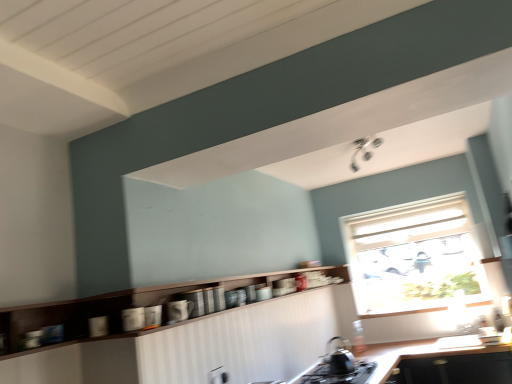
Question: Considering the positions of matte ceramic mug at center, marked as the second appliance in a front-to-back arrangement, and black matte tea pot at lower center in the image, is matte ceramic mug at center, marked as the second appliance in a front-to-back arrangement, wider or thinner than black matte tea pot at lower center?

Choices:
 (A) wide
 (B) thin

Answer: (B)

Question: Does point (183, 294) appear closer or farther from the camera than point (343, 337)?

Choices:
 (A) closer
 (B) farther

Answer: (A)

Question: Which object is positioned closest to the black matte countertop at lower center?

Choices:
 (A) black matte gas stove at lower center
 (B) white textured window at upper right
 (C) glossy ceramic mug at lower center, the 2th appliance in the back-to-front sequence
 (D) wooden cabinet at center
 (E) black matte tea pot at lower center

Answer: (A)

Question: Considering the real-world distances, which object is closest to the glossy ceramic mug at lower center, the 2th appliance in the back-to-front sequence?

Choices:
 (A) white textured window at upper right
 (B) matte ceramic mug at center, positioned as the first appliance in back-to-front order
 (C) black matte tea pot at lower center
 (D) wooden cabinet at center
 (E) black matte countertop at lower center

Answer: (B)